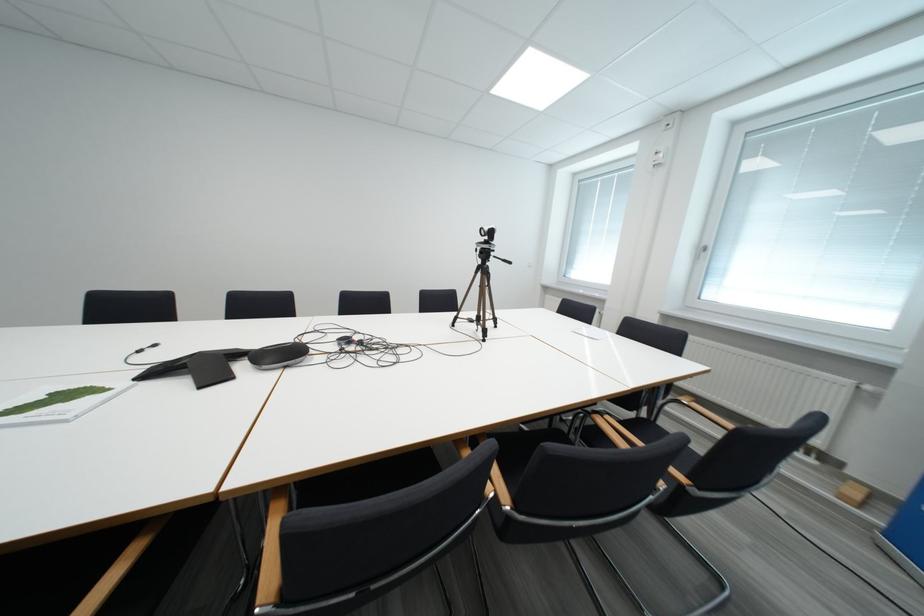
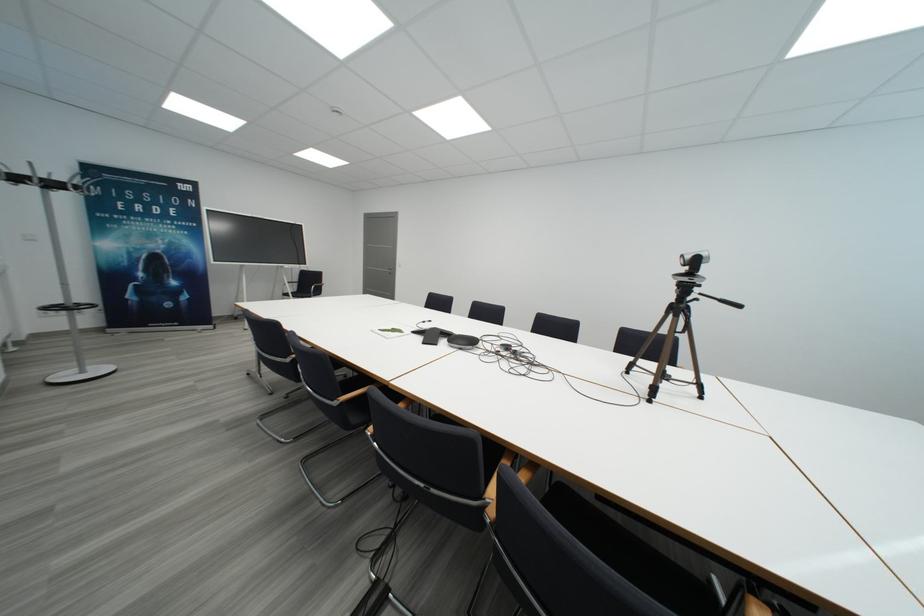
The point at (x=70, y=400) is marked in the first image. Where is the corresponding point in the second image?

(400, 333)